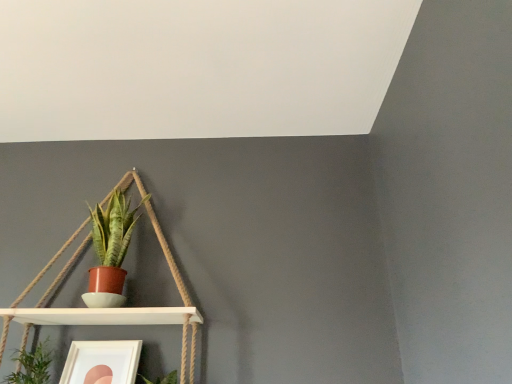
Locate an element on the screen. white matte shelf at left is located at coordinates (168, 255).

Considering the relative positions of matte terracotta pot at center-left, positioned as the 2th houseplant in left-to-right order, and green leafy plant at lower left, which is the 2th houseplant in right-to-left order, in the image provided, is matte terracotta pot at center-left, positioned as the 2th houseplant in left-to-right order, to the left or to the right of green leafy plant at lower left, which is the 2th houseplant in right-to-left order,?

Clearly, matte terracotta pot at center-left, positioned as the 2th houseplant in left-to-right order, is on the right of green leafy plant at lower left, which is the 2th houseplant in right-to-left order, in the image.

From the image's perspective, which one is positioned lower, matte terracotta pot at center-left, marked as the 1th houseplant in a right-to-left arrangement, or green leafy plant at lower left, which is the second houseplant from top to bottom?

green leafy plant at lower left, which is the second houseplant from top to bottom, from the image's perspective.

From the picture: Considering the relative sizes of matte terracotta pot at center-left, the second houseplant in the bottom-to-top sequence, and green leafy plant at lower left, the 1th houseplant from the bottom, in the image provided, is matte terracotta pot at center-left, the second houseplant in the bottom-to-top sequence, shorter than green leafy plant at lower left, the 1th houseplant from the bottom,?

Incorrect, the height of matte terracotta pot at center-left, the second houseplant in the bottom-to-top sequence, does not fall short of that of green leafy plant at lower left, the 1th houseplant from the bottom.

Which of these two, white matte shelf at left or matte terracotta pot at center-left, marked as the 1th houseplant in a right-to-left arrangement, is thinner?

matte terracotta pot at center-left, marked as the 1th houseplant in a right-to-left arrangement.

From the image's perspective, between white matte shelf at left and matte terracotta pot at center-left, the second houseplant in the bottom-to-top sequence, who is located below?

white matte shelf at left, from the image's perspective.

Where is `shelf to the left of matte terracotta pot at center-left, marked as the 1th houseplant in a right-to-left arrangement`? This screenshot has width=512, height=384. shelf to the left of matte terracotta pot at center-left, marked as the 1th houseplant in a right-to-left arrangement is located at coordinates (168, 255).

Is white matte shelf at left a part of matte terracotta pot at center-left, positioned as the 2th houseplant in left-to-right order?

Definitely not — white matte shelf at left is not inside matte terracotta pot at center-left, positioned as the 2th houseplant in left-to-right order.

Between matte terracotta pot at center-left, positioned as the 2th houseplant in left-to-right order, and white matte shelf at left, which one has smaller size?

matte terracotta pot at center-left, positioned as the 2th houseplant in left-to-right order, is smaller.

Does point (98, 283) come in front of point (123, 177)?

Yes, it is in front of point (123, 177).

Locate an element on the screen. houseplant that is the 2nd one when counting upward from the white matte picture frame at lower left (from the image's perspective) is located at coordinates (110, 251).

Considering the sizes of objects white matte picture frame at lower left and matte terracotta pot at center-left, the second houseplant in the bottom-to-top sequence, in the image provided, who is taller, white matte picture frame at lower left or matte terracotta pot at center-left, the second houseplant in the bottom-to-top sequence,?

matte terracotta pot at center-left, the second houseplant in the bottom-to-top sequence, is taller.

From the image's perspective, relative to matte terracotta pot at center-left, the second houseplant in the bottom-to-top sequence, is white matte picture frame at lower left above or below?

From the image's perspective, white matte picture frame at lower left appears below matte terracotta pot at center-left, the second houseplant in the bottom-to-top sequence.

Does point (88, 351) appear closer or farther from the camera than point (112, 250)?

Point (88, 351) appears to be closer to the viewer than point (112, 250).

Locate an element on the screen. houseplant in front of the white matte picture frame at lower left is located at coordinates (32, 365).

Is white matte picture frame at lower left next to green leafy plant at lower left, which is the second houseplant from top to bottom?

white matte picture frame at lower left and green leafy plant at lower left, which is the second houseplant from top to bottom, are not in contact.

Which object is further away from the camera taking this photo, white matte picture frame at lower left or green leafy plant at lower left, which is the 2th houseplant in right-to-left order?

white matte picture frame at lower left is more distant.

Could you tell me if white matte picture frame at lower left is facing green leafy plant at lower left, which is the 2th houseplant in right-to-left order?

No, white matte picture frame at lower left is not aimed at green leafy plant at lower left, which is the 2th houseplant in right-to-left order.

Is green leafy plant at lower left, the first houseplant in the left-to-right sequence, surrounding white matte shelf at left?

No, white matte shelf at left is not a part of green leafy plant at lower left, the first houseplant in the left-to-right sequence.

What's the angular difference between green leafy plant at lower left, which is the second houseplant from top to bottom, and white matte shelf at left's facing directions?

green leafy plant at lower left, which is the second houseplant from top to bottom, and white matte shelf at left are facing 0.888 degrees away from each other.

Which object is positioned more to the right, green leafy plant at lower left, which is the 2th houseplant in right-to-left order, or white matte shelf at left?

Positioned to the right is white matte shelf at left.

Which is in front, point (36, 361) or point (188, 298)?

The point (36, 361) is closer to the camera.

Which of these two, green leafy plant at lower left, the 1th houseplant from the bottom, or matte terracotta pot at center-left, the second houseplant in the bottom-to-top sequence, is smaller?

Smaller between the two is green leafy plant at lower left, the 1th houseplant from the bottom.

Is green leafy plant at lower left, the first houseplant in the left-to-right sequence, far from matte terracotta pot at center-left, marked as the 1th houseplant in a right-to-left arrangement?

Actually, green leafy plant at lower left, the first houseplant in the left-to-right sequence, and matte terracotta pot at center-left, marked as the 1th houseplant in a right-to-left arrangement, are a little close together.

The width and height of the screenshot is (512, 384). In order to click on houseplant beneath the matte terracotta pot at center-left, positioned as the 2th houseplant in left-to-right order (from a real-world perspective) in this screenshot , I will do `click(32, 365)`.

Locate an element on the screen. Image resolution: width=512 pixels, height=384 pixels. houseplant behind the green leafy plant at lower left, which is the second houseplant from top to bottom is located at coordinates (110, 251).

Locate an element on the screen. This screenshot has height=384, width=512. houseplant above the white matte shelf at left (from a real-world perspective) is located at coordinates (110, 251).

Looking at the image, which one is located further to white matte shelf at left, matte terracotta pot at center-left, positioned as the first houseplant in top-to-bottom order, or green leafy plant at lower left, the 1th houseplant from the bottom?

Among the two, green leafy plant at lower left, the 1th houseplant from the bottom, is located further to white matte shelf at left.

Considering their positions, is white matte picture frame at lower left positioned further to green leafy plant at lower left, the first houseplant in the left-to-right sequence, than white matte shelf at left?

white matte shelf at left lies further to green leafy plant at lower left, the first houseplant in the left-to-right sequence, than the other object.

Estimate the real-world distances between objects in this image. Which object is further from white matte picture frame at lower left, white matte shelf at left or green leafy plant at lower left, the first houseplant in the left-to-right sequence?

Among the two, white matte shelf at left is located further to white matte picture frame at lower left.

Looking at the image, which one is located closer to white matte picture frame at lower left, green leafy plant at lower left, the 1th houseplant from the bottom, or white matte shelf at left?

Based on the image, green leafy plant at lower left, the 1th houseplant from the bottom, appears to be nearer to white matte picture frame at lower left.

Looking at the image, which one is located closer to matte terracotta pot at center-left, positioned as the 2th houseplant in left-to-right order, white matte picture frame at lower left or white matte shelf at left?

white matte shelf at left.

From the image, which object appears to be farther from green leafy plant at lower left, the first houseplant in the left-to-right sequence, white matte shelf at left or white matte picture frame at lower left?

white matte shelf at left is further to green leafy plant at lower left, the first houseplant in the left-to-right sequence.

Which object lies nearer to the anchor point white matte shelf at left, white matte picture frame at lower left or matte terracotta pot at center-left, positioned as the 2th houseplant in left-to-right order?

matte terracotta pot at center-left, positioned as the 2th houseplant in left-to-right order.

Based on their spatial positions, is green leafy plant at lower left, the first houseplant in the left-to-right sequence, or white matte picture frame at lower left further from matte terracotta pot at center-left, the second houseplant in the bottom-to-top sequence?

The object further to matte terracotta pot at center-left, the second houseplant in the bottom-to-top sequence, is green leafy plant at lower left, the first houseplant in the left-to-right sequence.

Identify the location of shelf between matte terracotta pot at center-left, positioned as the first houseplant in top-to-bottom order, and white matte picture frame at lower left in the up-down direction. coord(168,255).

At what (x,y) coordinates should I click in order to perform the action: click on shelf between matte terracotta pot at center-left, marked as the 1th houseplant in a right-to-left arrangement, and green leafy plant at lower left, the 1th houseplant from the bottom, in the vertical direction. Please return your answer as a coordinate pair (x, y). The width and height of the screenshot is (512, 384). Looking at the image, I should click on (168, 255).

Image resolution: width=512 pixels, height=384 pixels. Identify the location of houseplant that lies between white matte shelf at left and white matte picture frame at lower left from top to bottom. (32, 365).

At what (x,y) coordinates should I click in order to perform the action: click on houseplant between matte terracotta pot at center-left, positioned as the 2th houseplant in left-to-right order, and white matte picture frame at lower left in the up-down direction. Please return your answer as a coordinate pair (x, y). This screenshot has height=384, width=512. Looking at the image, I should click on (32, 365).